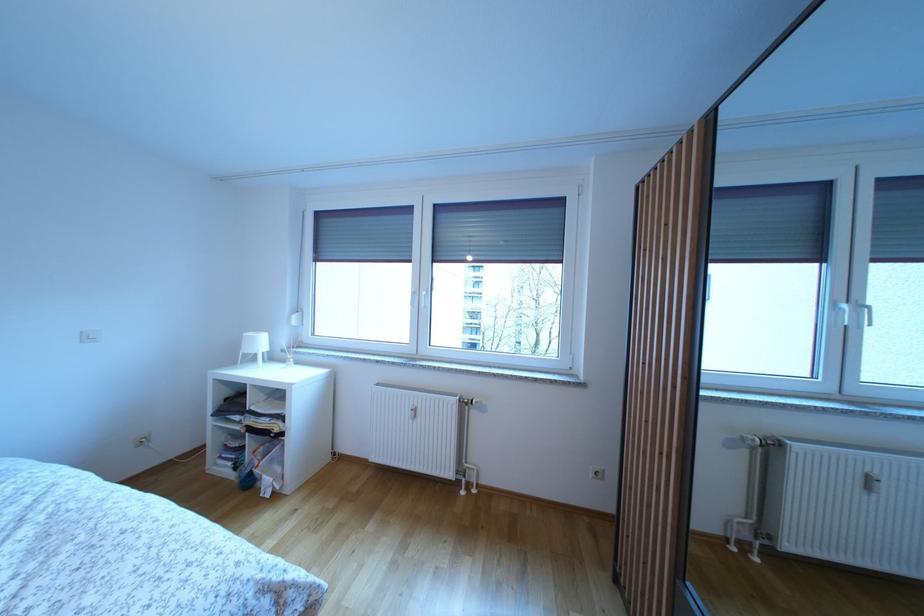
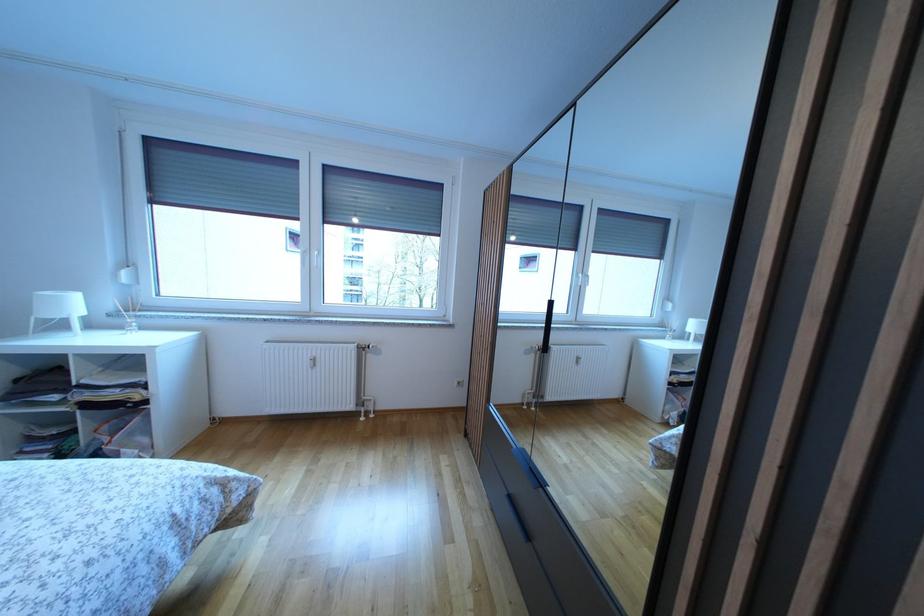
Find the pixel in the second image that matches point (268, 349) in the first image.

(78, 310)